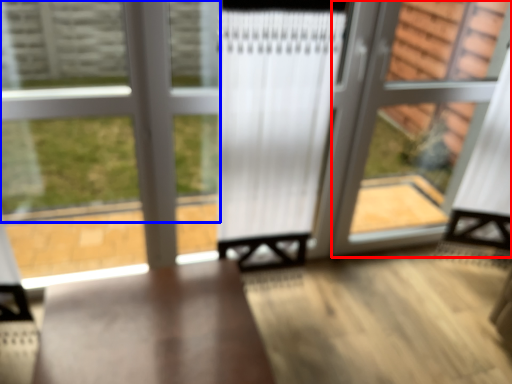
Question: Which point is further to the camera, screen door (highlighted by a red box) or bay window (highlighted by a blue box)?

Choices:
 (A) screen door
 (B) bay window

Answer: (A)